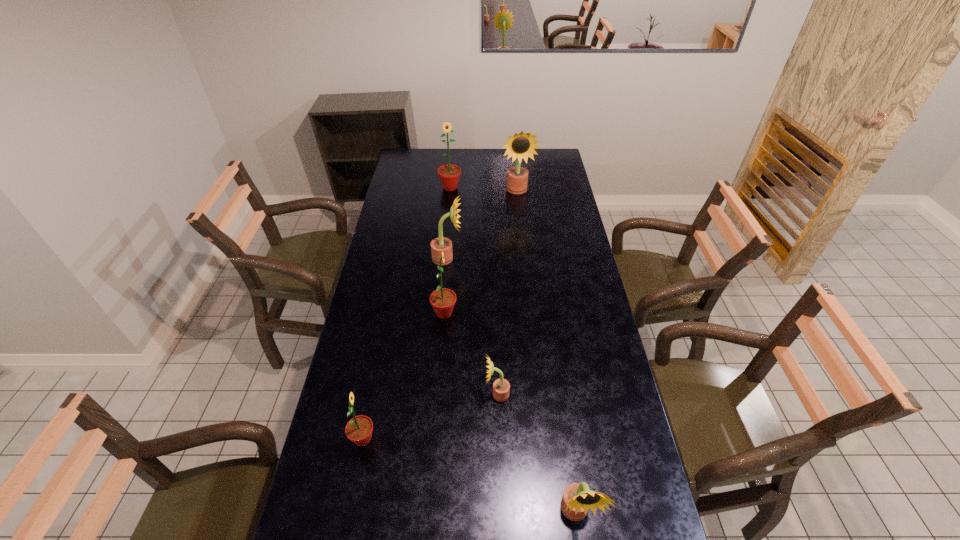
Where is `the smallest yellow sunflower`? This screenshot has width=960, height=540. the smallest yellow sunflower is located at coordinates (501, 387).

Image resolution: width=960 pixels, height=540 pixels. I want to click on the fifth farthest sunflower, so click(x=501, y=387).

You are a GUI agent. You are given a task and a screenshot of the screen. Output one action in this format:
    pyautogui.click(x=<x>, y=<y>)
    Task: Click on the vacant space located on the face of the farthest yellow sunflower
    
    Given the screenshot: What is the action you would take?
    pyautogui.click(x=520, y=222)

Identify the location of vacant space located 0.240m on the face of the farthest green sunflower. Image resolution: width=960 pixels, height=540 pixels. (447, 223).

This screenshot has height=540, width=960. I want to click on free space located on the face of the third smallest yellow sunflower, so click(x=521, y=258).

Where is `vacant region located 0.070m on the face of the fourth nearest object`? The height and width of the screenshot is (540, 960). vacant region located 0.070m on the face of the fourth nearest object is located at coordinates (476, 313).

Image resolution: width=960 pixels, height=540 pixels. In order to click on blank space located on the face of the smallest green sunflower in this screenshot , I will do `click(403, 439)`.

You are a GUI agent. You are given a task and a screenshot of the screen. Output one action in this format:
    pyautogui.click(x=<x>, y=<y>)
    Task: Click on the free space located 0.170m on the face of the fifth farthest object
    
    Given the screenshot: What is the action you would take?
    pyautogui.click(x=432, y=394)

The height and width of the screenshot is (540, 960). I want to click on vacant region located on the face of the fifth farthest object, so click(x=467, y=394).

Find the location of `blank space located 0.130m on the face of the fifth farthest object`. blank space located 0.130m on the face of the fifth farthest object is located at coordinates (444, 394).